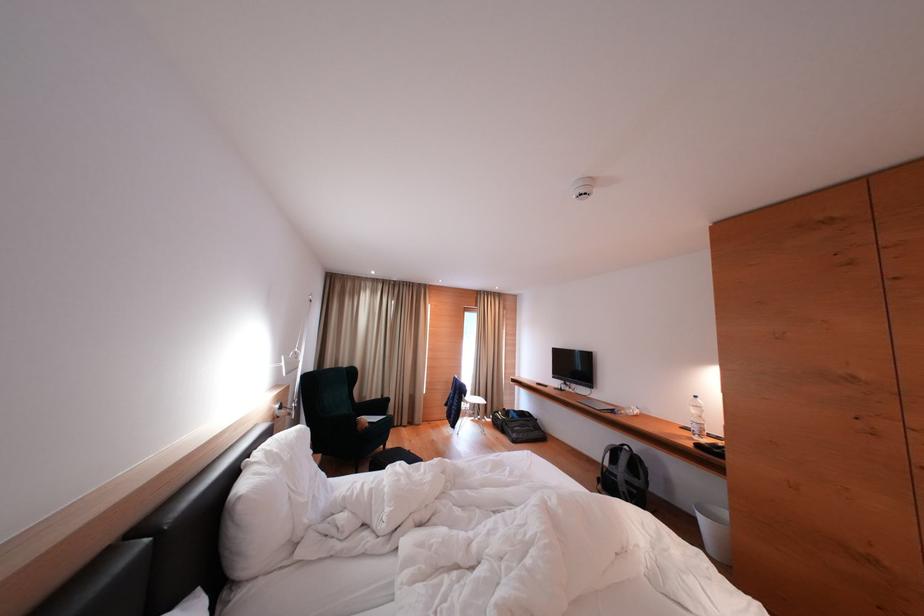
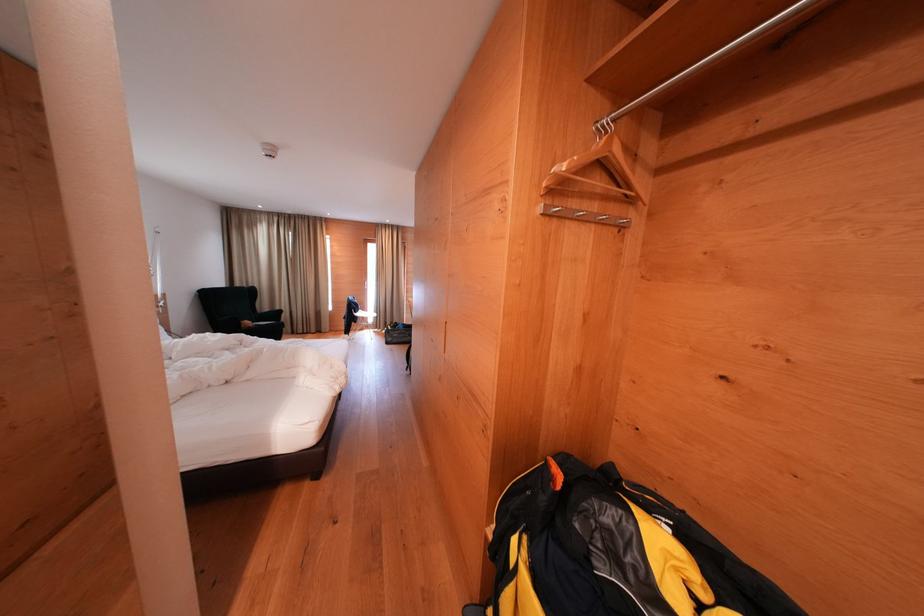
Locate, in the second image, the point that corresponds to point 362,428 in the first image.

(247, 329)